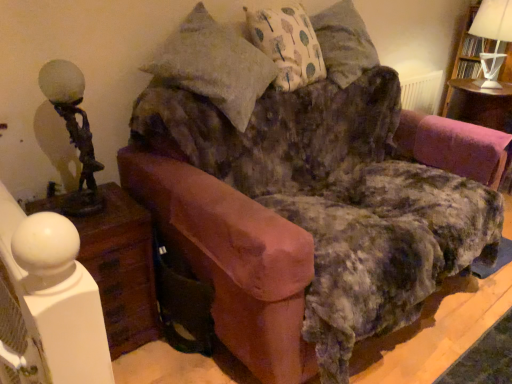
Question: Does white fabric lampshade at upper right, positioned as the 1th table lamp in right-to-left order, have a lesser height compared to white paper lampshade at upper right?

Choices:
 (A) no
 (B) yes

Answer: (B)

Question: Is white fabric lampshade at upper right, positioned as the 2th table lamp in front-to-back order, to the right of white paper lampshade at upper right from the viewer's perspective?

Choices:
 (A) no
 (B) yes

Answer: (A)

Question: Is white fabric lampshade at upper right, the 1th table lamp when ordered from back to front, touching white paper lampshade at upper right?

Choices:
 (A) yes
 (B) no

Answer: (B)

Question: From a real-world perspective, does white fabric lampshade at upper right, arranged as the second table lamp when viewed from the left, sit lower than white paper lampshade at upper right?

Choices:
 (A) no
 (B) yes

Answer: (A)

Question: Is white fabric lampshade at upper right, which is the 1th table lamp from top to bottom, facing towards white paper lampshade at upper right?

Choices:
 (A) no
 (B) yes

Answer: (A)

Question: From their relative heights in the image, would you say white paper lampshade at upper right is taller or shorter than white wood nightstand at lower left?

Choices:
 (A) short
 (B) tall

Answer: (B)

Question: From a real-world perspective, is white paper lampshade at upper right positioned above or below white wood nightstand at lower left?

Choices:
 (A) below
 (B) above

Answer: (B)

Question: Based on their sizes in the image, would you say white paper lampshade at upper right is bigger or smaller than white wood nightstand at lower left?

Choices:
 (A) small
 (B) big

Answer: (A)

Question: From the image's perspective, relative to white wood nightstand at lower left, is white paper lampshade at upper right above or below?

Choices:
 (A) below
 (B) above

Answer: (B)

Question: From a real-world perspective, relative to bronze/golden statue-like at left, acting as the 1th table lamp starting from the bottom, is white fabric lampshade at upper right, the 2th table lamp when ordered from bottom to top, vertically above or below?

Choices:
 (A) above
 (B) below

Answer: (A)

Question: Do you think white fabric lampshade at upper right, arranged as the second table lamp when viewed from the left, is within bronze/golden statue-like at left, which appears as the 1th table lamp when viewed from the front, or outside of it?

Choices:
 (A) outside
 (B) inside

Answer: (A)

Question: Is point (507, 19) positioned closer to the camera than point (97, 193)?

Choices:
 (A) farther
 (B) closer

Answer: (A)

Question: From the image's perspective, is white fabric lampshade at upper right, arranged as the second table lamp when viewed from the left, above or below bronze/golden statue-like at left, arranged as the second table lamp when viewed from the top?

Choices:
 (A) above
 (B) below

Answer: (A)

Question: Is white wood nightstand at lower left wider or thinner than white paper lampshade at upper right?

Choices:
 (A) thin
 (B) wide

Answer: (B)

Question: In the image, is white wood nightstand at lower left positioned in front of or behind white paper lampshade at upper right?

Choices:
 (A) behind
 (B) front

Answer: (B)